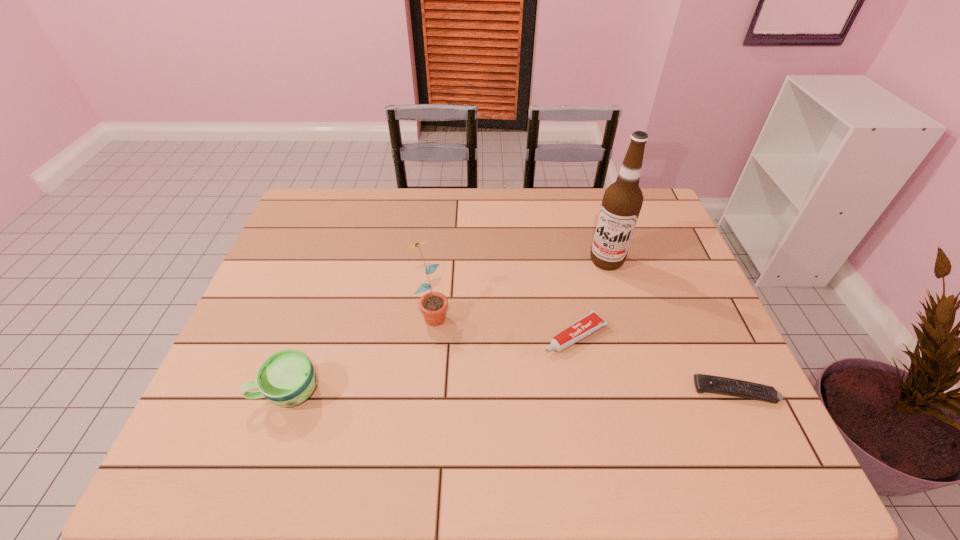
Where is `free spot on the desktop that is between the cup and the remote control and is positioned at the nozzle of the toothpaste`? The image size is (960, 540). free spot on the desktop that is between the cup and the remote control and is positioned at the nozzle of the toothpaste is located at coordinates (487, 392).

Locate an element on the screen. Image resolution: width=960 pixels, height=540 pixels. vacant space on the desktop that is between the third tallest object and the shortest object and is positioned on the label of the farthest object is located at coordinates (545, 392).

At what (x,y) coordinates should I click in order to perform the action: click on vacant space on the desktop that is between the cup and the shortest object and is positioned on the flower of the second tallest object. Please return your answer as a coordinate pair (x, y). The width and height of the screenshot is (960, 540). Looking at the image, I should click on (491, 392).